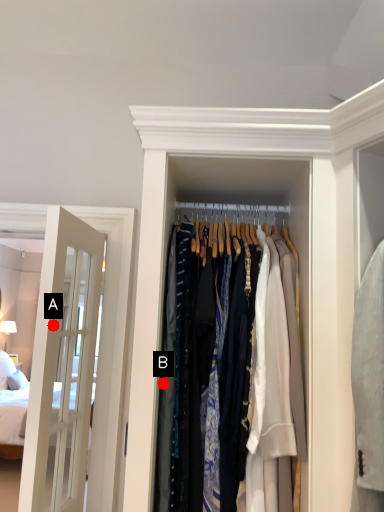
Question: Two points are circled on the image, labeled by A and B beside each circle. Among these points, which one is farthest from the camera?

Choices:
 (A) A is further
 (B) B is further

Answer: (A)